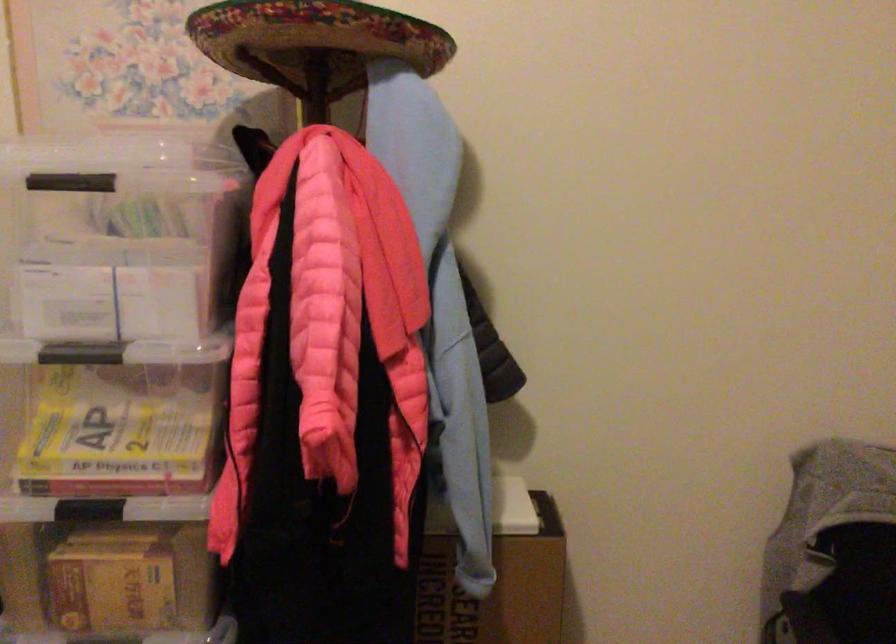
Which object does [112,582] point to?

It corresponds to the small yellow box in the image.